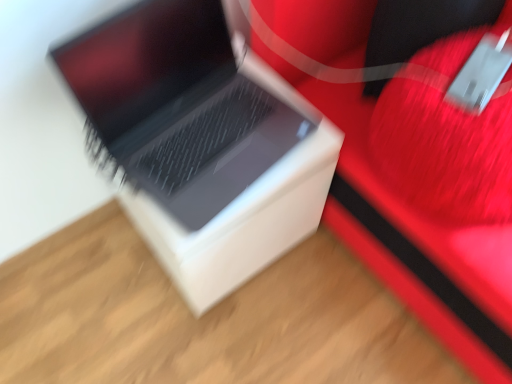
What do you see at coordinates (242, 222) in the screenshot? The width and height of the screenshot is (512, 384). I see `white matte cardboard box at center` at bounding box center [242, 222].

Where is `rubberized red suitcase at center`? rubberized red suitcase at center is located at coordinates (410, 153).

You are a GUI agent. You are given a task and a screenshot of the screen. Output one action in this format:
    pyautogui.click(x=<x>, y=<y>)
    Task: Click on the sleek silver laptop at center
    
    Given the screenshot: What is the action you would take?
    pyautogui.click(x=176, y=106)

Does sleek silver laptop at center lie in front of rubberized red suitcase at center?

No, it is behind rubberized red suitcase at center.

Is sleek silver laptop at center at the left side of rubberized red suitcase at center?

Yes.

Locate an element on the screen. This screenshot has height=384, width=512. furniture on the right of sleek silver laptop at center is located at coordinates (410, 153).

From a real-world perspective, is sleek silver laptop at center below rubberized red suitcase at center?

No, from a real-world perspective, sleek silver laptop at center is not below rubberized red suitcase at center.

Find the location of a particular element. Image resolution: width=512 pixels, height=384 pixels. cardboard box on the left of rubberized red suitcase at center is located at coordinates (242, 222).

Considering the relative sizes of rubberized red suitcase at center and white matte cardboard box at center in the image provided, is rubberized red suitcase at center smaller than white matte cardboard box at center?

No.

Would you say rubberized red suitcase at center is a long distance from white matte cardboard box at center?

That's not correct — rubberized red suitcase at center is a little close to white matte cardboard box at center.

Consider the image. Is rubberized red suitcase at center shorter than white matte cardboard box at center?

Incorrect, the height of rubberized red suitcase at center does not fall short of that of white matte cardboard box at center.

Considering the relative sizes of rubberized red suitcase at center and sleek silver laptop at center in the image provided, is rubberized red suitcase at center taller than sleek silver laptop at center?

Yes, rubberized red suitcase at center is taller than sleek silver laptop at center.

From the image's perspective, is rubberized red suitcase at center located above sleek silver laptop at center?

Yes, from the image's perspective, rubberized red suitcase at center is above sleek silver laptop at center.

Consider the image. Does rubberized red suitcase at center come in front of sleek silver laptop at center?

Yes, it is in front of sleek silver laptop at center.

In terms of size, does rubberized red suitcase at center appear bigger or smaller than sleek silver laptop at center?

rubberized red suitcase at center is bigger than sleek silver laptop at center.

Is white matte cardboard box at center looking in the opposite direction of sleek silver laptop at center?

white matte cardboard box at center is not turned away from sleek silver laptop at center.

From the image's perspective, is white matte cardboard box at center under sleek silver laptop at center?

Yes.

Is white matte cardboard box at center smaller than sleek silver laptop at center?

No.

From a real-world perspective, which is physically below, sleek silver laptop at center or white matte cardboard box at center?

white matte cardboard box at center is physically lower.

Consider the image. Considering the sizes of objects sleek silver laptop at center and white matte cardboard box at center in the image provided, who is shorter, sleek silver laptop at center or white matte cardboard box at center?

With less height is sleek silver laptop at center.

Is sleek silver laptop at center to the left of white matte cardboard box at center from the viewer's perspective?

Incorrect, sleek silver laptop at center is not on the left side of white matte cardboard box at center.

From the picture: Measure the distance from sleek silver laptop at center to white matte cardboard box at center.

Result: sleek silver laptop at center and white matte cardboard box at center are 6.62 inches apart.

Does point (244, 244) appear closer or farther from the camera than point (397, 238)?

Clearly, point (244, 244) is more distant from the camera than point (397, 238).

Are white matte cardboard box at center and rubberized red suitcase at center beside each other?

No, white matte cardboard box at center is not beside rubberized red suitcase at center.

What's the angular difference between white matte cardboard box at center and rubberized red suitcase at center's facing directions?

white matte cardboard box at center and rubberized red suitcase at center are facing 0.00038 degrees away from each other.

Looking at this image, between white matte cardboard box at center and rubberized red suitcase at center, which one has larger width?

rubberized red suitcase at center.

Image resolution: width=512 pixels, height=384 pixels. What are the coordinates of `furniture that is in front of the sleek silver laptop at center` in the screenshot? It's located at (410, 153).

Locate an element on the screen. The height and width of the screenshot is (384, 512). furniture on the right of white matte cardboard box at center is located at coordinates (410, 153).

Considering their positions, is rubberized red suitcase at center positioned closer to white matte cardboard box at center than sleek silver laptop at center?

sleek silver laptop at center lies closer to white matte cardboard box at center than the other object.

Looking at the image, which one is located further to rubberized red suitcase at center, sleek silver laptop at center or white matte cardboard box at center?

sleek silver laptop at center is further to rubberized red suitcase at center.

When comparing their distances from sleek silver laptop at center, does white matte cardboard box at center or rubberized red suitcase at center seem closer?

Based on the image, white matte cardboard box at center appears to be nearer to sleek silver laptop at center.

Based on their spatial positions, is sleek silver laptop at center or rubberized red suitcase at center further from white matte cardboard box at center?

rubberized red suitcase at center is positioned further to the anchor white matte cardboard box at center.

From the image, which object appears to be nearer to sleek silver laptop at center, rubberized red suitcase at center or white matte cardboard box at center?

white matte cardboard box at center lies closer to sleek silver laptop at center than the other object.

Which object lies nearer to the anchor point rubberized red suitcase at center, white matte cardboard box at center or sleek silver laptop at center?

white matte cardboard box at center is closer to rubberized red suitcase at center.

Identify the location of laptop located between white matte cardboard box at center and rubberized red suitcase at center in the left-right direction. [x=176, y=106].